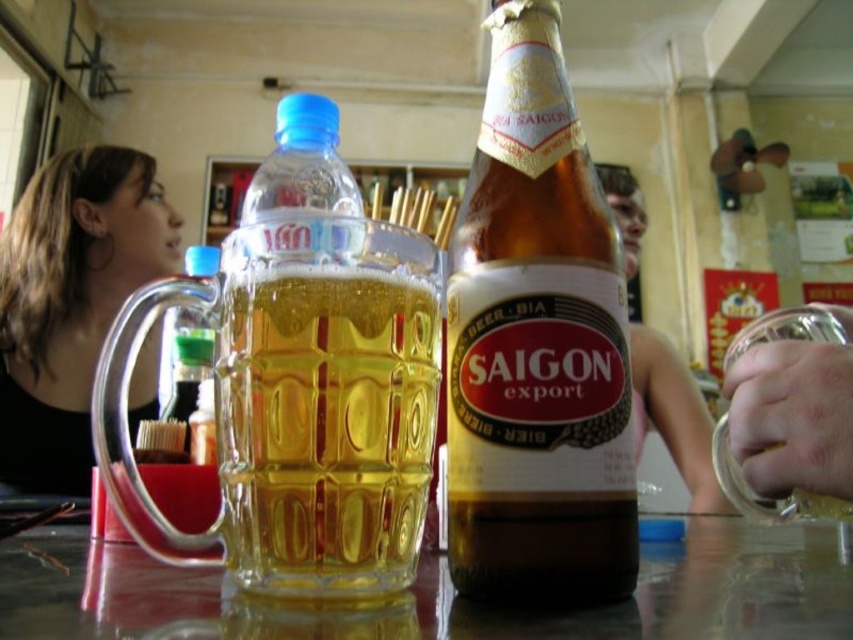
Does transparent glass table at center have a greater width compared to transparent glass beer glass at center?

Correct, the width of transparent glass table at center exceeds that of transparent glass beer glass at center.

Is point (656, 577) positioned behind point (744, 346)?

No, (656, 577) is closer to viewer.

Where is `transparent glass table at center`? transparent glass table at center is located at coordinates (438, 595).

Is brown glass bottle at center shorter than black fabric hair at left?

Indeed, brown glass bottle at center has a lesser height compared to black fabric hair at left.

Does point (502, 202) come behind point (148, 381)?

No, it is not.

Does point (624, 403) come closer to viewer compared to point (54, 420)?

Yes, it is in front of point (54, 420).

I want to click on brown glass bottle at center, so click(537, 342).

Which is more to the right, transparent glass table at center or black fabric hair at left?

transparent glass table at center

Can you confirm if transparent glass table at center is thinner than black fabric hair at left?

In fact, transparent glass table at center might be wider than black fabric hair at left.

Which is in front, point (538, 628) or point (33, 308)?

Point (538, 628)

Identify the location of transparent glass table at center. (438, 595).